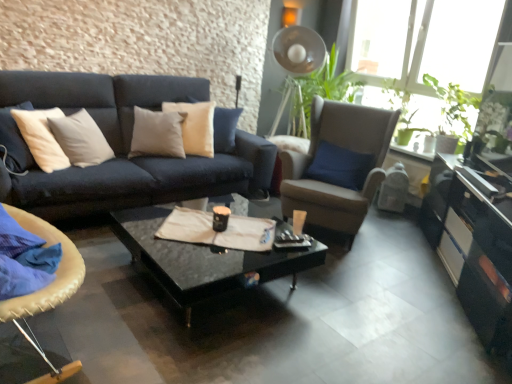
Question: In the image, is black glossy coffee table at center on the left side or the right side of green matte plant at upper right?

Choices:
 (A) right
 (B) left

Answer: (B)

Question: Considering the positions of black glossy coffee table at center and green matte plant at upper right in the image, is black glossy coffee table at center taller or shorter than green matte plant at upper right?

Choices:
 (A) tall
 (B) short

Answer: (B)

Question: Which object is positioned farthest from the leather cushioned chair at lower left, positioned as the second chair in right-to-left order?

Choices:
 (A) suede-like beige armchair at center-right, which appears as the 1th chair when viewed from the back
 (B) black glossy coffee table at center
 (C) matte black coffee cup at center
 (D) glossy black cabinet at lower right
 (E) green matte plant at upper right

Answer: (E)

Question: Which object is the farthest from the matte black coffee cup at center?

Choices:
 (A) black glossy coffee table at center
 (B) glossy black cabinet at lower right
 (C) green matte plant at upper right
 (D) leather cushioned chair at lower left, which is the first chair from left to right
 (E) suede-like beige armchair at center-right, the second chair from the front

Answer: (C)